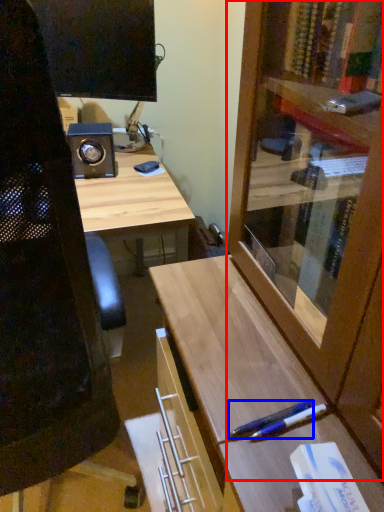
Question: Among these objects, which one is nearest to the camera, cabinetry (highlighted by a red box) or pen (highlighted by a blue box)?

Choices:
 (A) cabinetry
 (B) pen

Answer: (A)